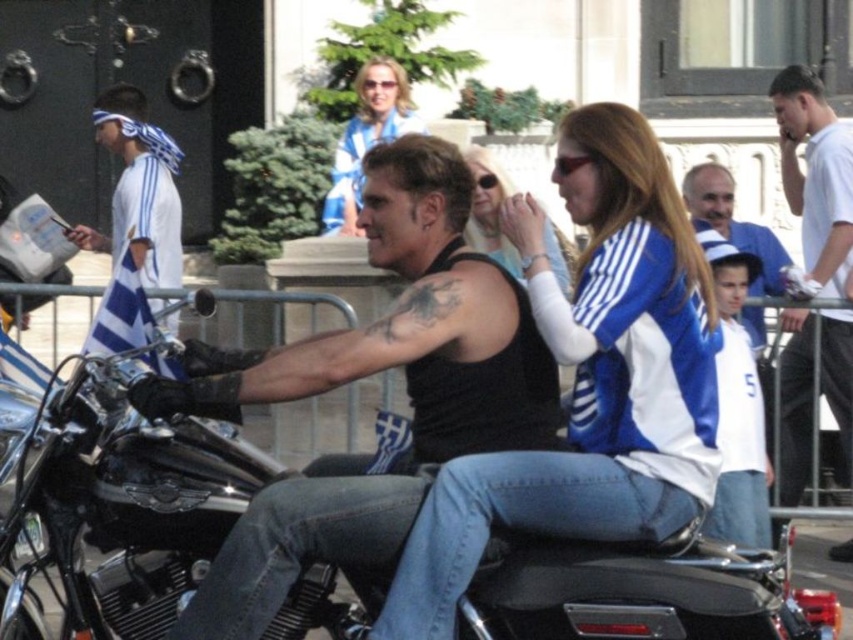
Can you confirm if shiny chrome motorcycle at center is shorter than white cotton shirt at upper right?

Yes.

Does shiny chrome motorcycle at center have a larger size compared to white cotton shirt at upper right?

Yes.

Between point (28, 532) and point (804, 456), which one is positioned behind?

Point (804, 456)

This screenshot has width=853, height=640. In order to click on shiny chrome motorcycle at center in this screenshot , I will do [115, 502].

Describe the element at coordinates (370, 372) in the screenshot. I see `black leather tank top at center` at that location.

From the picture: Is black leather tank top at center further to camera compared to blue and white jersey at center?

That is False.

Locate an element on the screen. This screenshot has width=853, height=640. black leather tank top at center is located at coordinates (370, 372).

What are the coordinates of `black leather tank top at center` in the screenshot? It's located at [370, 372].

Can you confirm if shiny chrome motorcycle at center is positioned above blue and white jersey at upper right?

Actually, shiny chrome motorcycle at center is below blue and white jersey at upper right.

Which is in front, point (169, 600) or point (727, 232)?

Positioned in front is point (169, 600).

You are a GUI agent. You are given a task and a screenshot of the screen. Output one action in this format:
    pyautogui.click(x=<x>, y=<y>)
    Task: Click on the shiny chrome motorcycle at center
    The width and height of the screenshot is (853, 640).
    Given the screenshot: What is the action you would take?
    pyautogui.click(x=115, y=502)